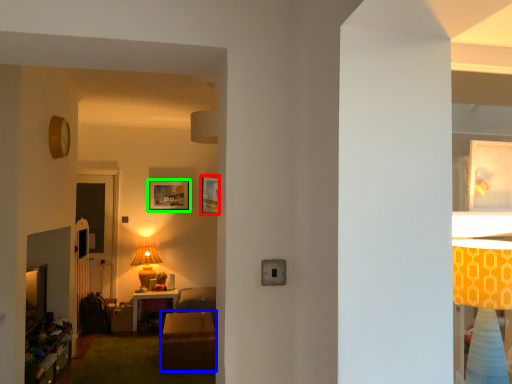
Question: Which is farther away from picture frame (highlighted by a red box)? table (highlighted by a blue box) or picture frame (highlighted by a green box)?

Choices:
 (A) table
 (B) picture frame

Answer: (A)